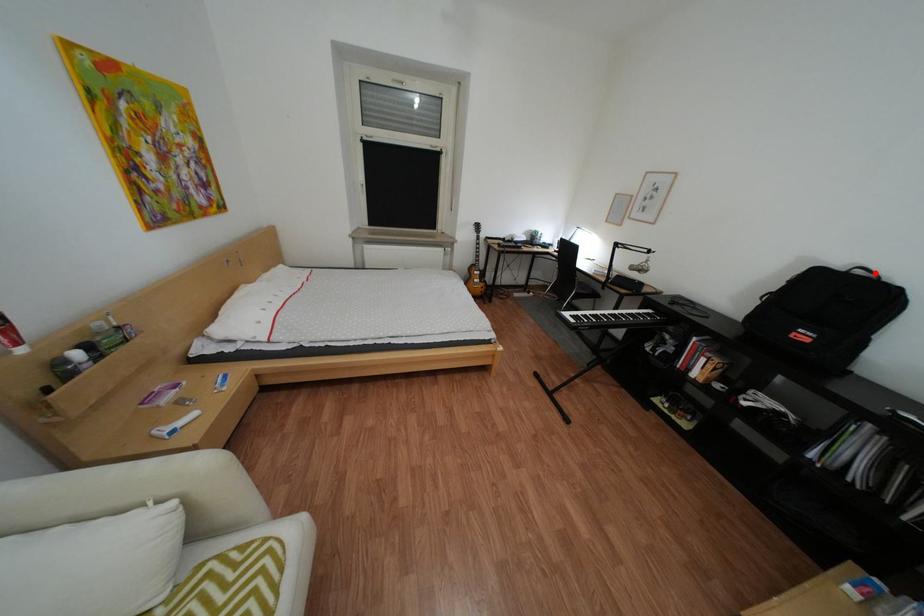
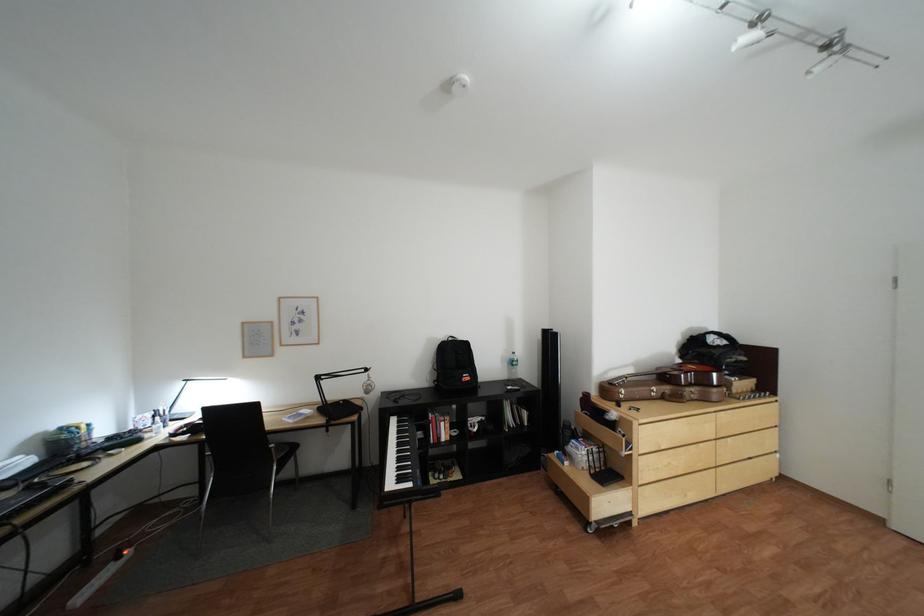
In the second image, find the point that corresponds to the highlighted location in the first image.

(466, 339)